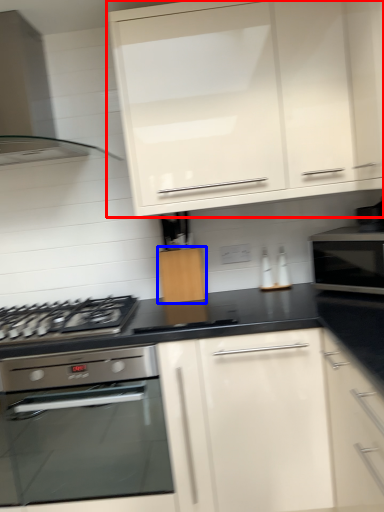
Question: Which object is closer to the camera taking this photo, cabinetry (highlighted by a red box) or cabinetry (highlighted by a blue box)?

Choices:
 (A) cabinetry
 (B) cabinetry

Answer: (A)